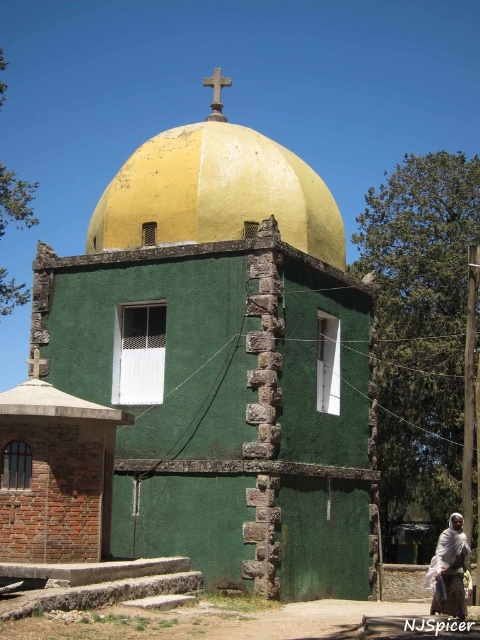
You are standing at a certain distance from the green stone church at center. If you want to take a photo of it, would you need to adjust your camera settings for long distance shots?

The green stone church at center and camera are 118.74 feet apart, so yes, you would need to adjust your camera settings for long distance shots to capture it clearly.

You are standing in front of the green stone church at center and want to place a small statue on the white textured cloth at lower right. Can you place it there without moving the cloth?

The green stone church at center is located above the white textured cloth at lower right, so you can place the statue on the cloth without moving it as the cloth is positioned below the church.

What are the coordinates of the yellow matte dome at center in the image?

The coordinates of the yellow matte dome at center are at point (x=216, y=193).